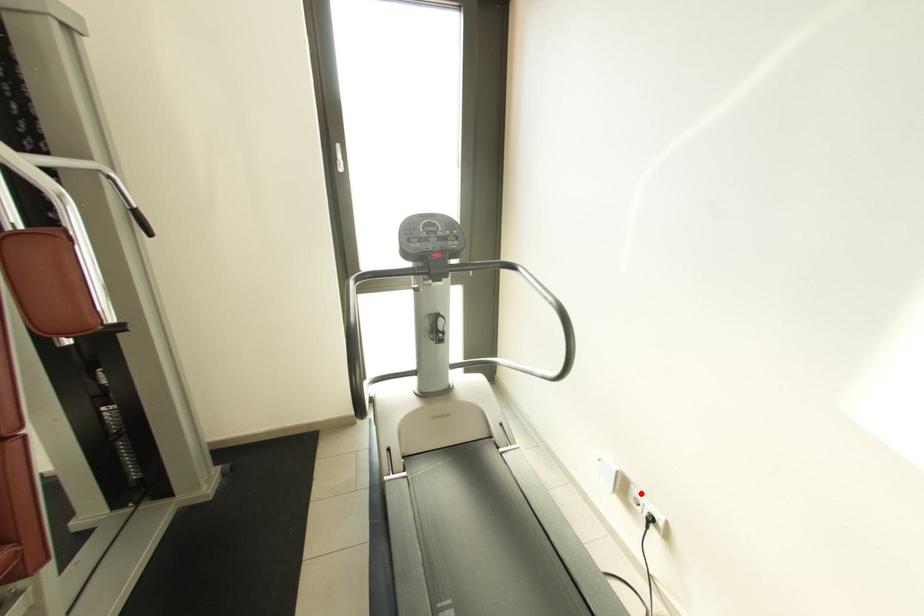
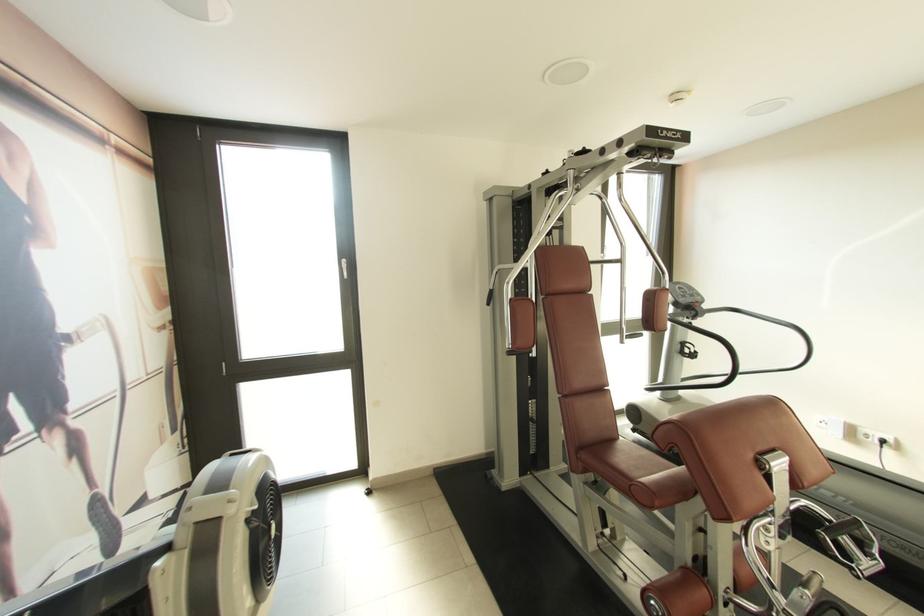
Find the pixel in the second image that matches the highlighted location in the first image.

(868, 432)